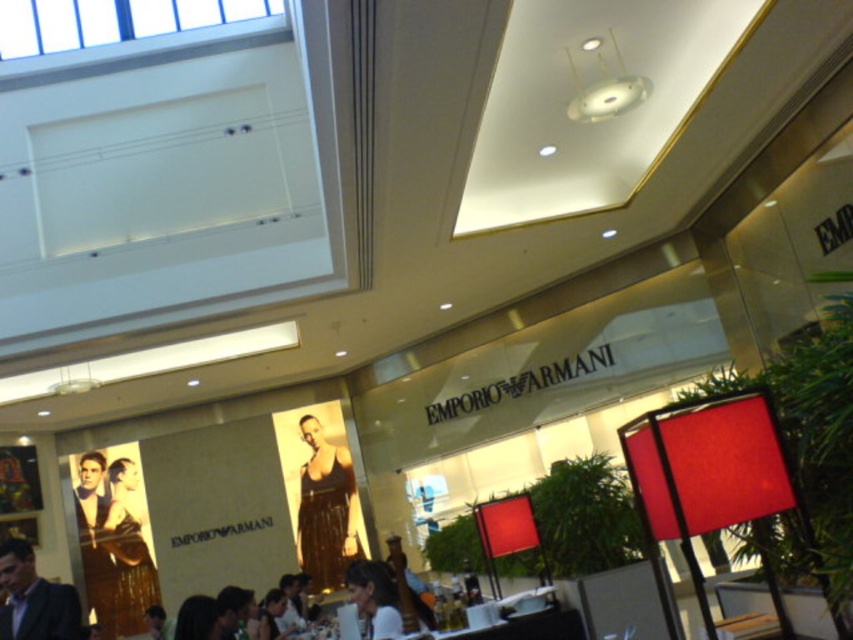
In the scene shown: Is shiny gold dress at center below dark suit at lower left?

Indeed, shiny gold dress at center is positioned under dark suit at lower left.

Who is positioned more to the left, shiny gold dress at center or dark suit at lower left?

dark suit at lower left

Who is more forward, (323, 448) or (57, 634)?

Point (57, 634) is in front.

Locate an element on the screen. Image resolution: width=853 pixels, height=640 pixels. shiny gold dress at center is located at coordinates (326, 509).

Can you confirm if shiny gold dress at center is positioned above matte black shirt at center?

Incorrect, shiny gold dress at center is not positioned above matte black shirt at center.

Is shiny gold dress at center to the right of matte black shirt at center from the viewer's perspective?

No, shiny gold dress at center is not to the right of matte black shirt at center.

Does point (332, 572) lie behind point (374, 563)?

Yes, point (332, 572) is behind point (374, 563).

I want to click on shiny gold dress at center, so click(326, 509).

Consider the image. Is dark suit at lower left above matte black shirt at center?

Yes, dark suit at lower left is above matte black shirt at center.

Based on the photo, between dark suit at lower left and matte black shirt at center, which one appears on the left side from the viewer's perspective?

dark suit at lower left

Looking at this image, who is more distant from viewer, (61, 593) or (357, 582)?

The point (357, 582) is behind.

You are a GUI agent. You are given a task and a screenshot of the screen. Output one action in this format:
    pyautogui.click(x=<x>, y=<y>)
    Task: Click on the dark suit at lower left
    
    Given the screenshot: What is the action you would take?
    pyautogui.click(x=33, y=598)